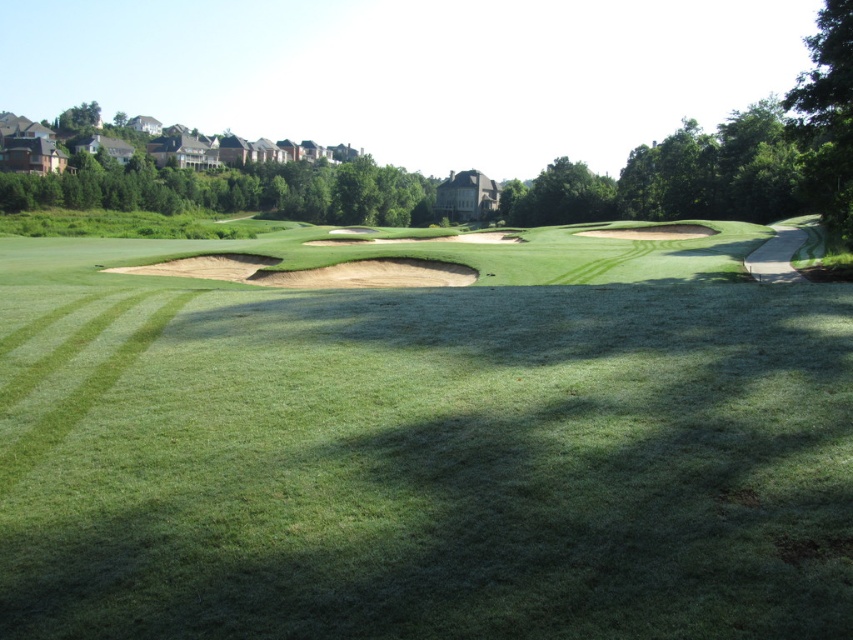
You are a golfer standing on the green grassy golf course at center. You want to hit your ball into the brown sand bunker at center. Considering the height difference between the two, will your ball roll into the bunker if you hit it gently?

Result: The green grassy golf course at center is higher than the brown sand bunker at center. Since the bunker is lower, the ball will naturally roll towards it if hit gently.